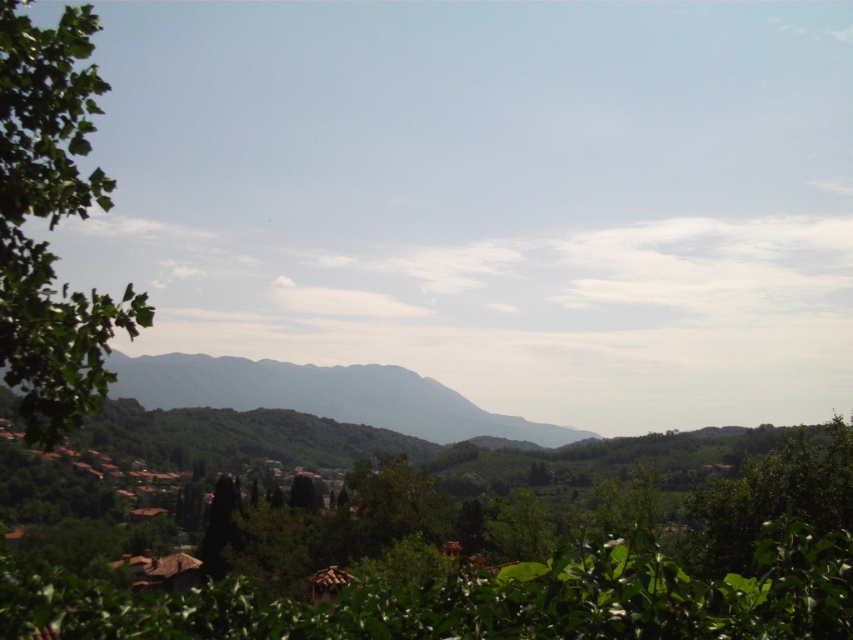
Question: Which point appears farthest from the camera in this image?

Choices:
 (A) (59, 205)
 (B) (613, 588)

Answer: (A)

Question: Which point is closer to the camera?

Choices:
 (A) (485, 600)
 (B) (7, 284)

Answer: (B)

Question: Is green leafy tree at center to the left of green leafy tree at left from the viewer's perspective?

Choices:
 (A) yes
 (B) no

Answer: (B)

Question: Is green leafy tree at left to the right of green textured mountain at center from the viewer's perspective?

Choices:
 (A) yes
 (B) no

Answer: (A)

Question: From the image, what is the correct spatial relationship of green leafy tree at center in relation to green textured mountain at center?

Choices:
 (A) below
 (B) above

Answer: (B)

Question: Which object is positioned closest to the green textured mountain at center?

Choices:
 (A) green leafy tree at center
 (B) green leafy tree at left

Answer: (A)